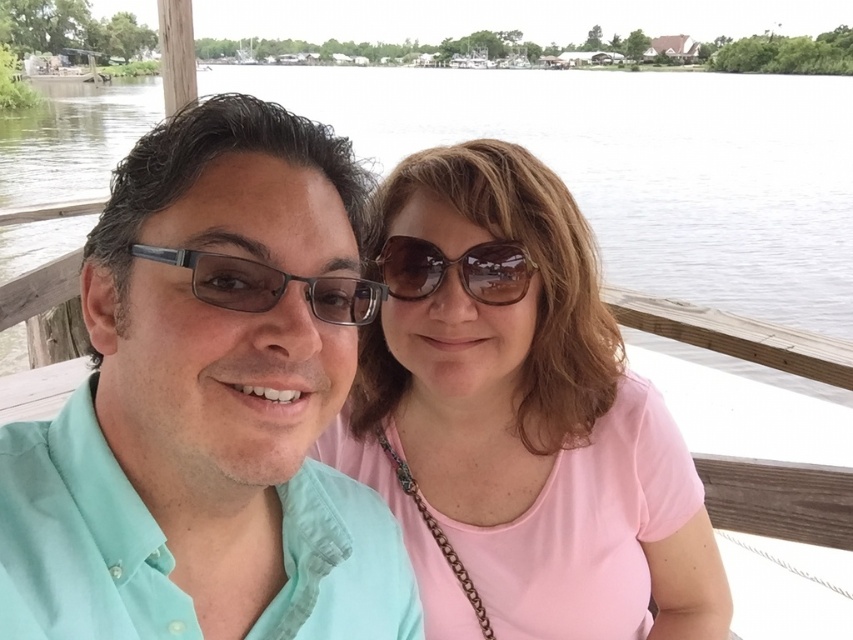
You are a photographer trying to capture a photo of the pink fabric shirt at center and the transparent water at center. Which object is shorter in height?

The pink fabric shirt at center is shorter in height compared to the transparent water at center.

You are taking a photo of the two people on the dock. The camera you are using has a depth of field that can focus clearly on objects within 1 meter from the camera. Is the point at coordinates point (393, 202) within the camera focus range?

The point at coordinates point (393, 202) is 1.09 meters away from the camera, which is slightly beyond the 1 meter focus range. Therefore, the point may not be in focus.

You are standing at the point marked as point (x=518, y=417). Looking around, you see the pink fabric shirt at center and the teal shirt on the left. Which direction should you face to look towards the teal shirt on the left?

The point (x=518, y=417) is on the pink fabric shirt at center. To look towards the teal shirt on the left, you should face to the left.